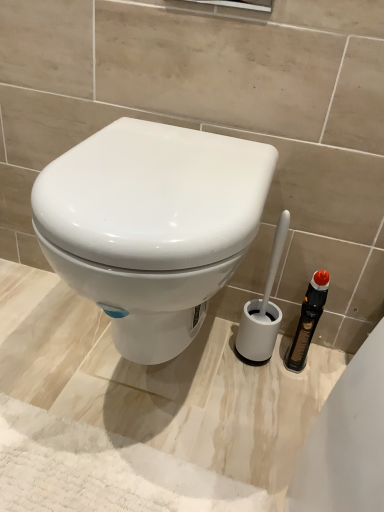
Image resolution: width=384 pixels, height=512 pixels. What are the coordinates of `free location to the right of white plastic toilet brush at right` in the screenshot? It's located at (303, 369).